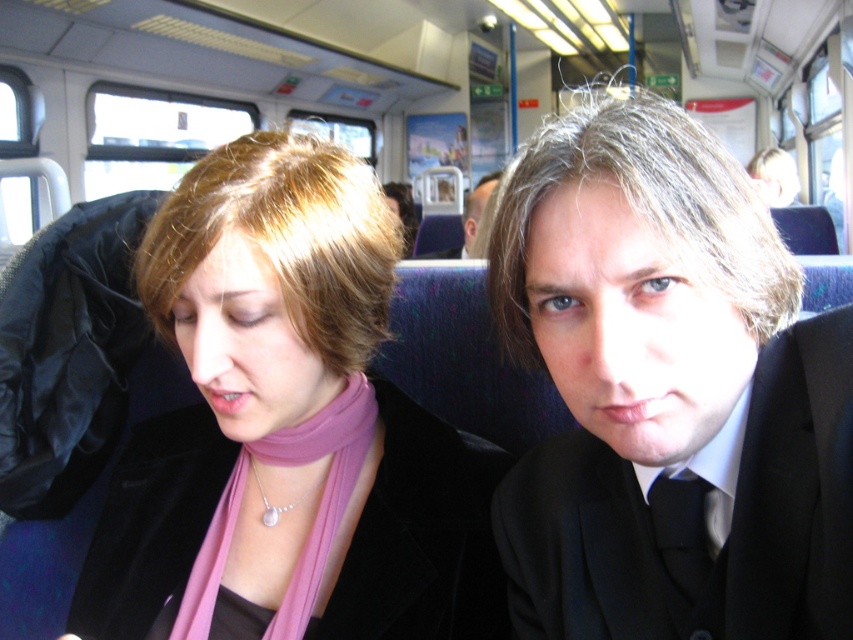
Question: Does pink fabric scarf at center lie behind smooth black suit at center?

Choices:
 (A) no
 (B) yes

Answer: (A)

Question: Which point is closer to the camera?

Choices:
 (A) matte black suit at center
 (B) pink silk scarf at center
 (C) smooth black suit at center

Answer: (A)

Question: Among these points, which one is nearest to the camera?

Choices:
 (A) (573, 365)
 (B) (466, 211)

Answer: (A)

Question: Is pink silk scarf at center positioned before smooth black suit at center?

Choices:
 (A) yes
 (B) no

Answer: (A)

Question: From the image, what is the correct spatial relationship of pink fabric scarf at center in relation to pink silk scarf at center?

Choices:
 (A) left
 (B) right

Answer: (B)

Question: Which of these objects is positioned farthest from the matte black suit at center?

Choices:
 (A) pink fabric scarf at center
 (B) pink silk scarf at center
 (C) smooth black suit at center

Answer: (C)